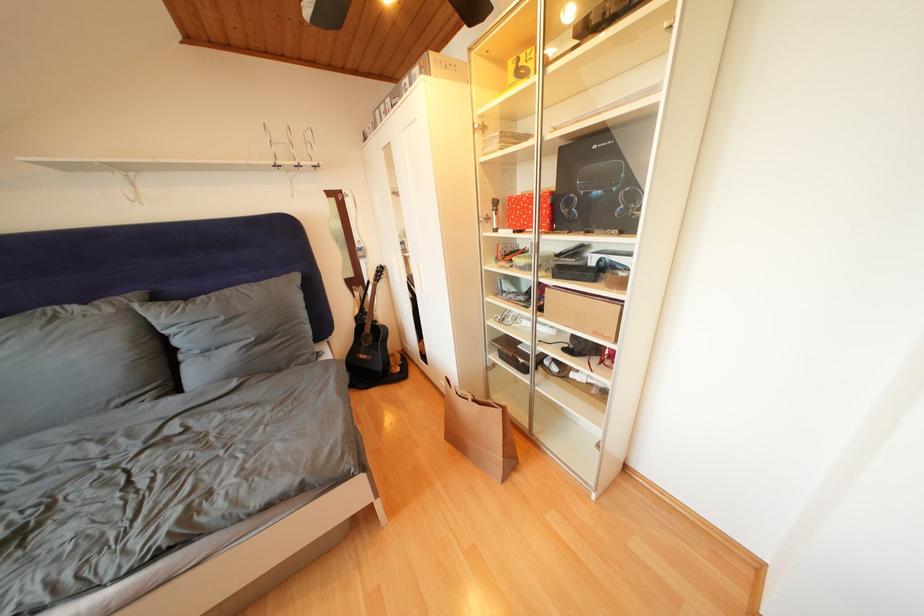
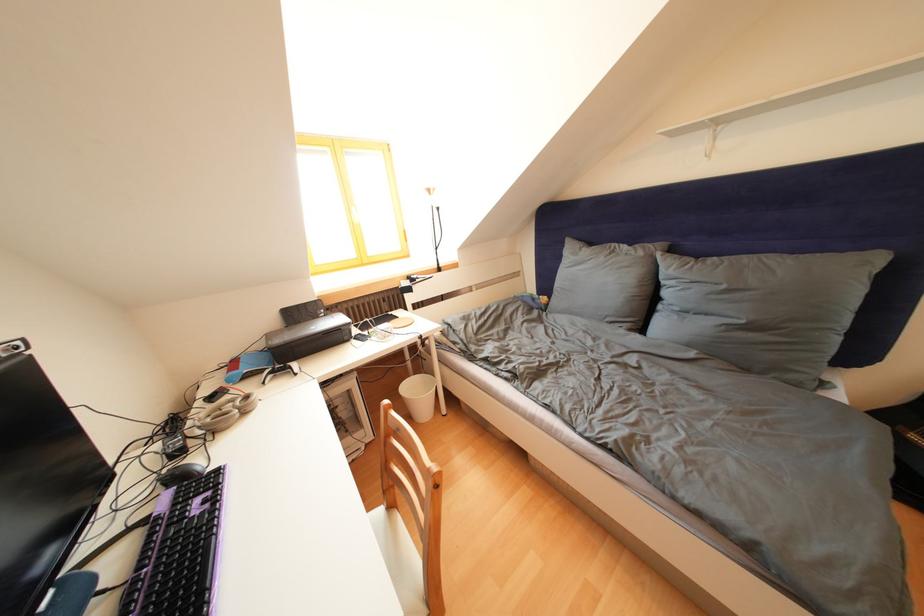
Where in the second image is the point corresponding to point 231,323 from the first image?

(733, 292)